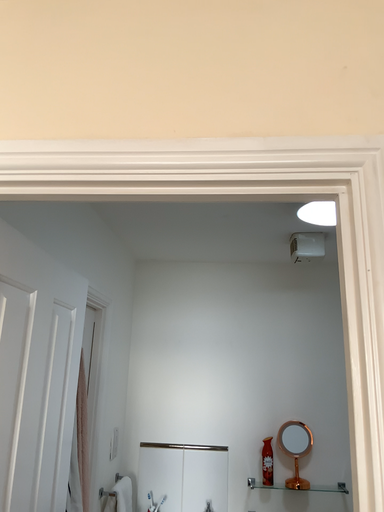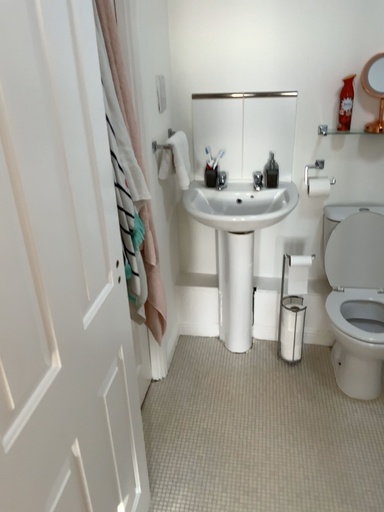
Question: How did the camera likely rotate when shooting the video?

Choices:
 (A) rotated upward
 (B) rotated downward

Answer: (B)